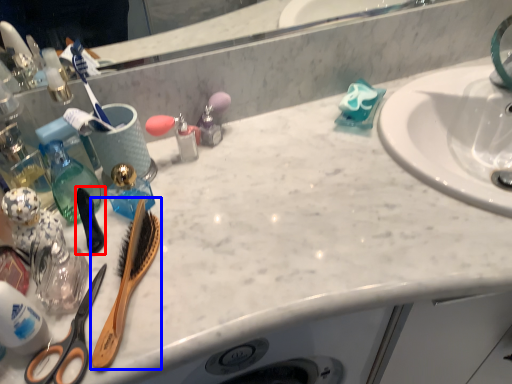
Question: Which object is closer to the camera taking this photo, brush (highlighted by a red box) or brush (highlighted by a blue box)?

Choices:
 (A) brush
 (B) brush

Answer: (B)